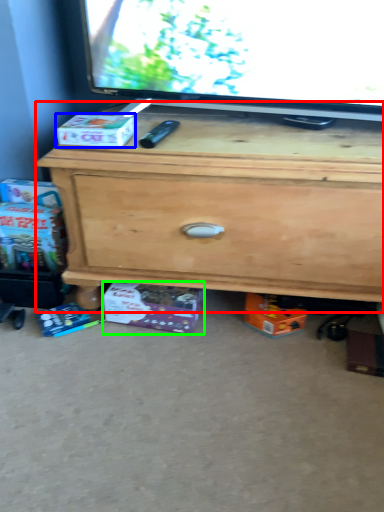
Question: Which object is the closest to the chest of drawers (highlighted by a red box)? Choose among these: box (highlighted by a blue box) or box (highlighted by a green box).

Choices:
 (A) box
 (B) box

Answer: (B)